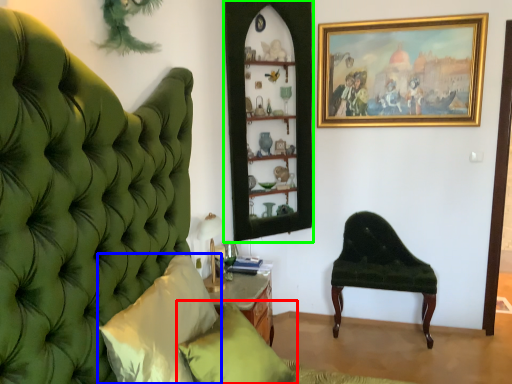
Question: Considering the real-world distances, which object is closest to pillow (highlighted by a red box)? pillow (highlighted by a blue box) or shelf (highlighted by a green box).

Choices:
 (A) pillow
 (B) shelf

Answer: (A)